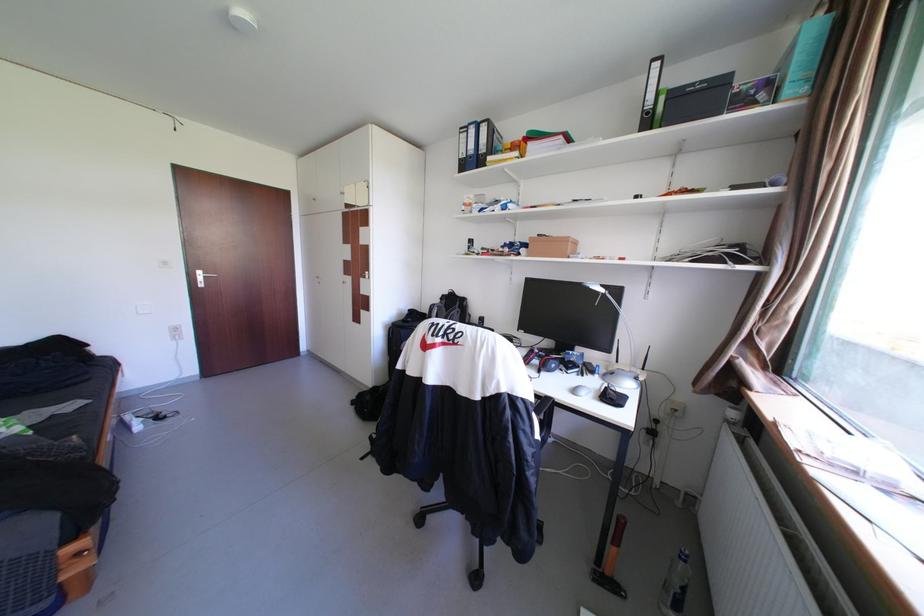
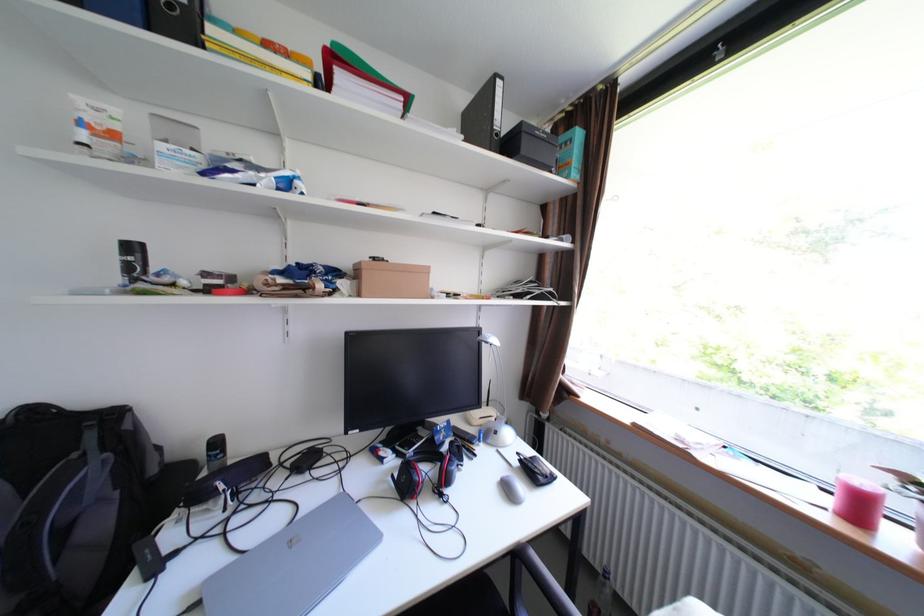
Locate, in the second image, the point that corresponds to point (659, 113) in the first image.

(507, 135)